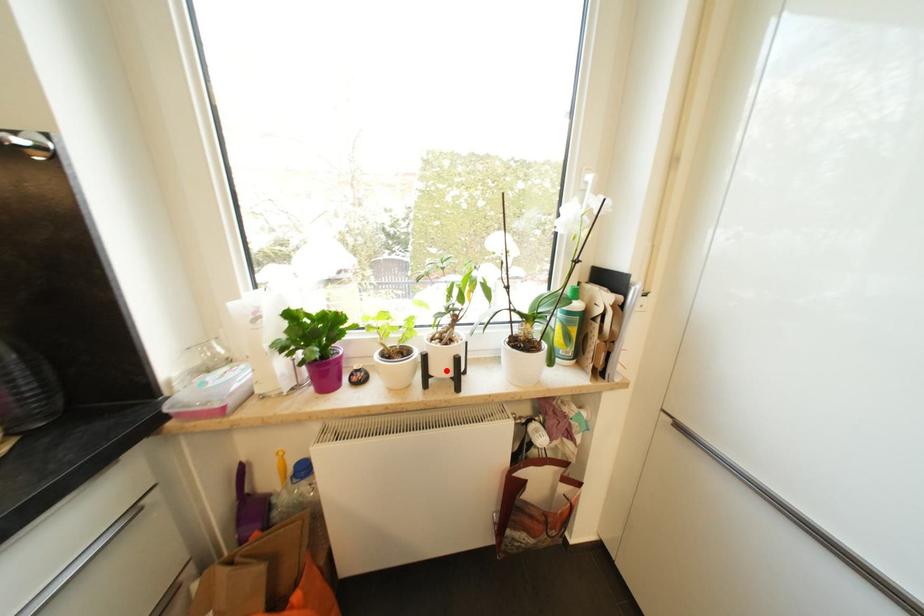
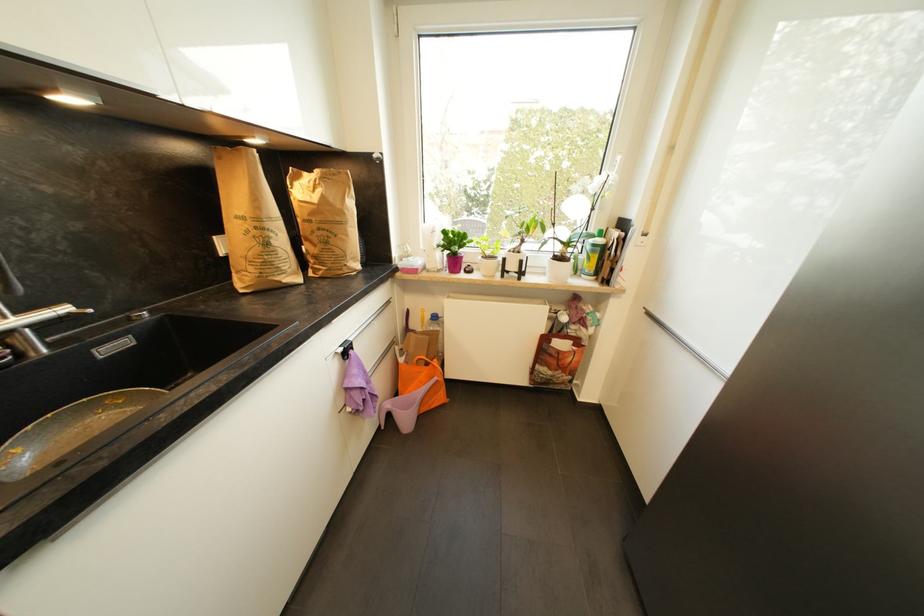
Question: A red point is marked in image1. In image2, is the corresponding 3D point closer to the camera or farther? Reply with the corresponding letter.

Choices:
 (A) The corresponding 3D point is closer.
 (B) The corresponding 3D point is farther.

Answer: (A)